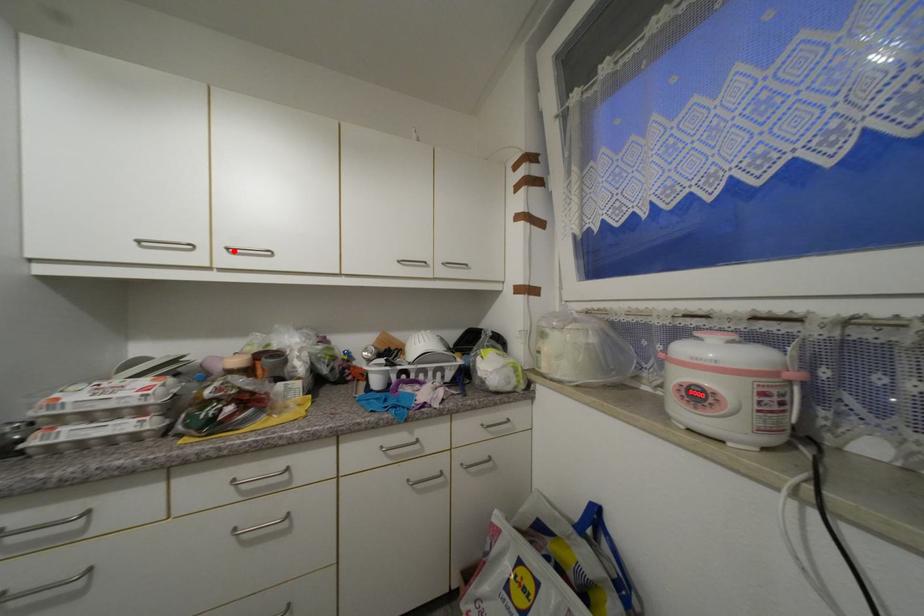
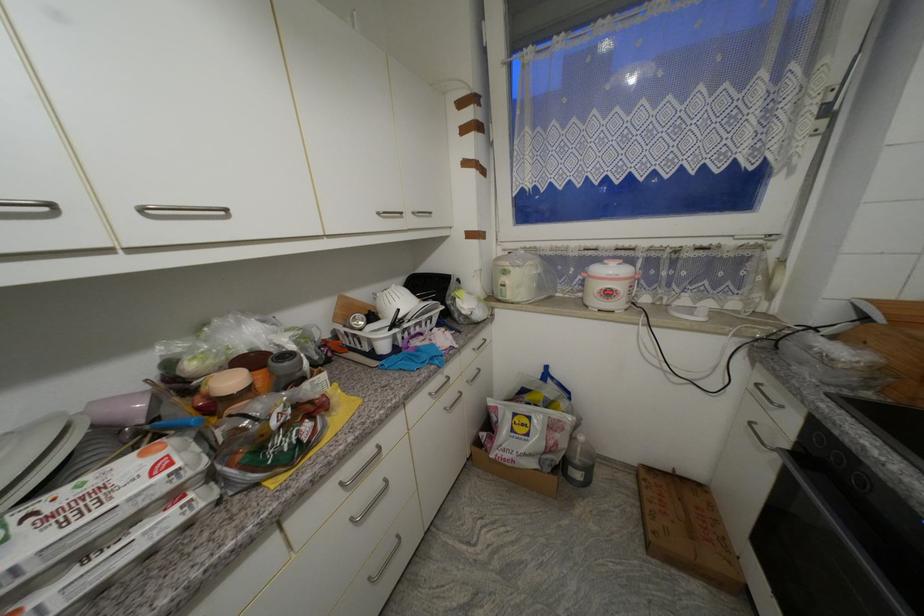
The point at the highlighted location is marked in the first image. Where is the corresponding point in the second image?

(149, 211)